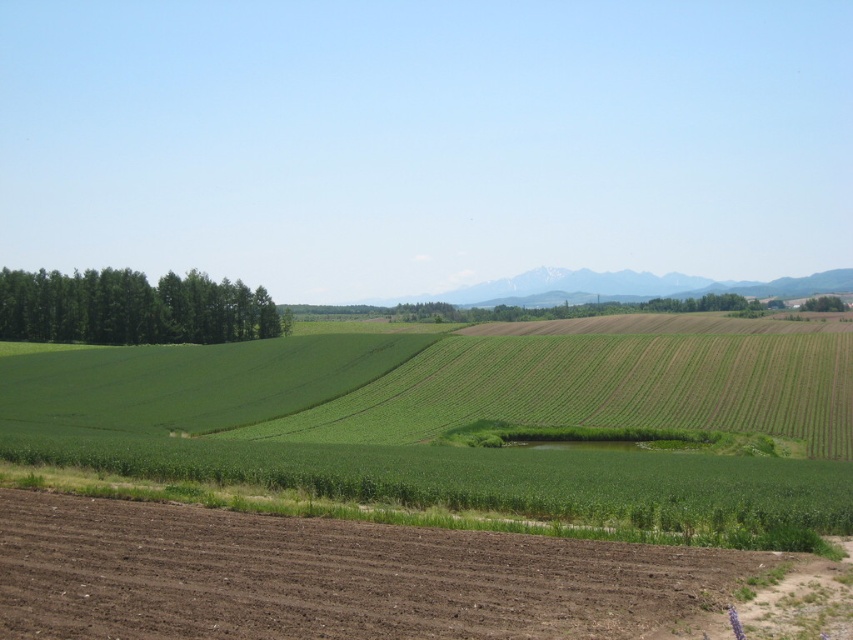
Between point (315, 593) and point (202, 413), which one is positioned behind?

Positioned behind is point (202, 413).

Which is above, brown soil at lower left or green grassy field at center?

green grassy field at center is higher up.

The image size is (853, 640). Find the location of `brown soil at lower left`. brown soil at lower left is located at coordinates (334, 577).

Who is higher up, green grassy field at center or green leafy trees at left?

Positioned higher is green leafy trees at left.

In order to click on green grassy field at center in this screenshot , I will do `click(463, 381)`.

Is point (488, 404) positioned behind point (39, 282)?

That is False.

Identify the location of green grassy field at center. This screenshot has width=853, height=640. (463, 381).

Which is more to the right, brown soil at lower left or green leafy tree at right?

From the viewer's perspective, green leafy tree at right appears more on the right side.

At what (x,y) coordinates should I click in order to perform the action: click on brown soil at lower left. Please return your answer as a coordinate pair (x, y). Looking at the image, I should click on pos(334,577).

Does point (184, 570) lie in front of point (817, 301)?

Yes, it is in front of point (817, 301).

Identify the location of brown soil at lower left. (334, 577).